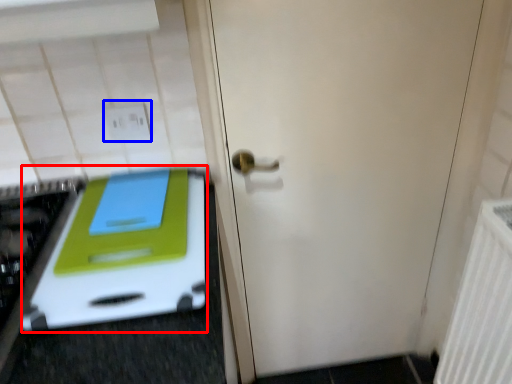
Question: Which object appears farthest to the camera in this image, oven (highlighted by a red box) or electric outlet (highlighted by a blue box)?

Choices:
 (A) oven
 (B) electric outlet

Answer: (B)